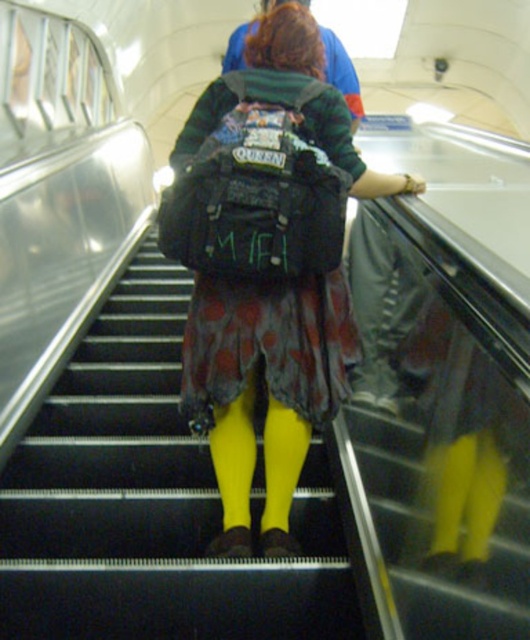
Question: Is matte black backpack at center to the right of leather at right from the viewer's perspective?

Choices:
 (A) yes
 (B) no

Answer: (B)

Question: In this image, where is yellow fabric stairs at center located relative to leather at right?

Choices:
 (A) below
 (B) above

Answer: (A)

Question: Is matte black backpack at center positioned at the back of leather at right?

Choices:
 (A) yes
 (B) no

Answer: (A)

Question: Which object is positioned closest to the matte black backpack at center?

Choices:
 (A) leather at right
 (B) yellow fabric stairs at center

Answer: (A)

Question: Considering the real-world distances, which object is closest to the yellow fabric stairs at center?

Choices:
 (A) leather at right
 (B) matte black backpack at center

Answer: (B)

Question: Among these points, which one is nearest to the camera?

Choices:
 (A) (325, 582)
 (B) (175, 180)
 (C) (399, 376)

Answer: (C)